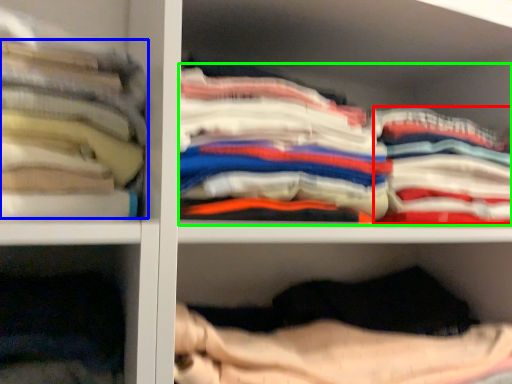
Question: Considering the real-world distances, which object is closest to clothing (highlighted by a red box)? clothing (highlighted by a blue box) or clothing (highlighted by a green box).

Choices:
 (A) clothing
 (B) clothing

Answer: (B)